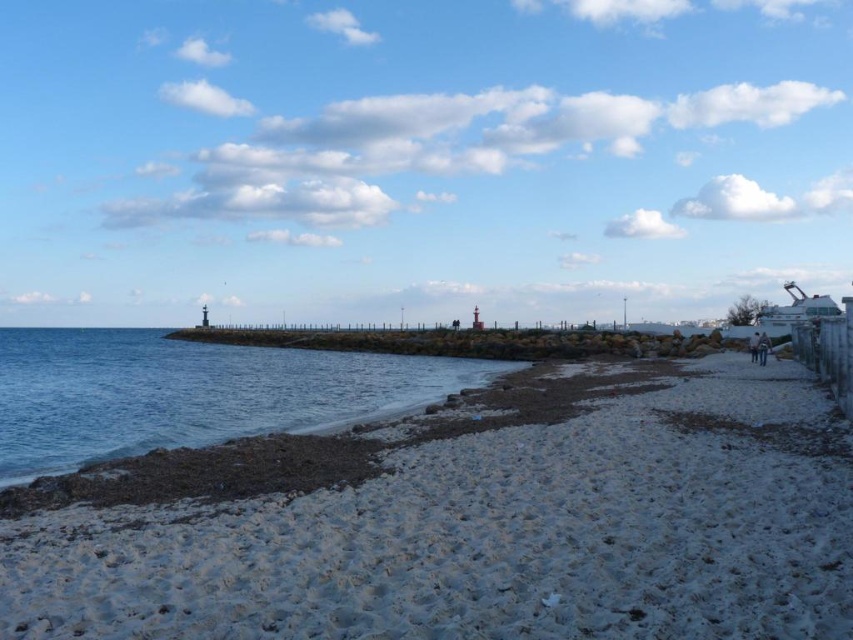
Question: Does light brown leather jacket at lower right appear over dark blue jeans at lower right?

Choices:
 (A) no
 (B) yes

Answer: (B)

Question: Which point appears farthest from the camera in this image?

Choices:
 (A) (759, 349)
 (B) (107, 445)
 (C) (756, 360)
 (D) (607, 582)

Answer: (C)

Question: Is white sandy beach at lower left wider than dark blue jeans at lower right?

Choices:
 (A) no
 (B) yes

Answer: (B)

Question: Which point is closer to the camera?

Choices:
 (A) (256, 588)
 (B) (751, 356)
 (C) (334, 404)

Answer: (A)

Question: Can you confirm if white sandy beach at lower left is wider than light brown leather jacket at lower right?

Choices:
 (A) yes
 (B) no

Answer: (A)

Question: Which point is farther to the camera?

Choices:
 (A) light brown leather jacket at lower right
 (B) white sandy beach at lower left
 (C) blue water at lower left
 (D) dark blue jeans at lower right

Answer: (D)